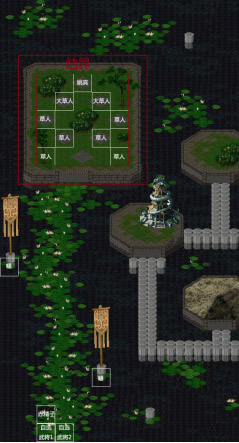
Identify the location of plant. The image size is (239, 443). (86, 115), (232, 149), (54, 81).